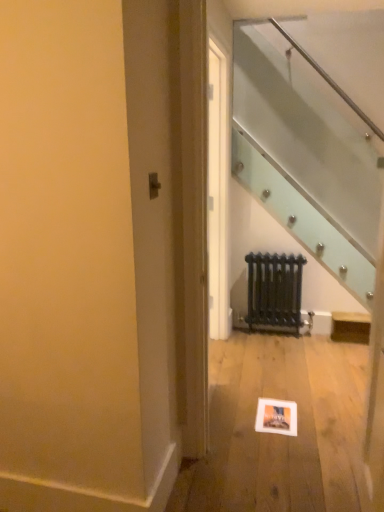
Identify the location of vacant space underneath matte orange picture frame at lower center (from a real-world perspective). (274, 411).